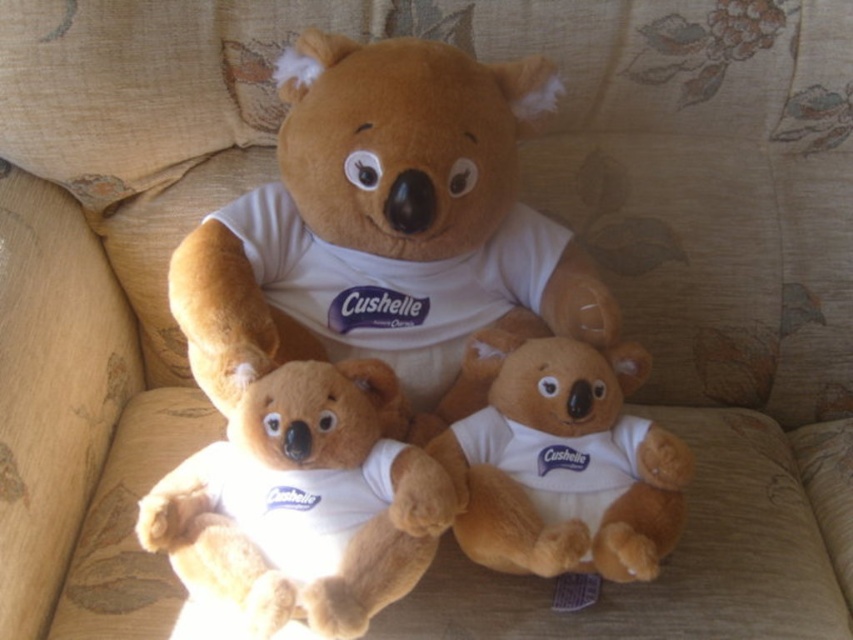
Based on the photo, you are looking at the image of three koala bears on the sofa. There is a point at coordinates (386, 227). Which object is located at that point?

The point at coordinates (386, 227) indicates the white soft t shirt at center.

You are a photographer trying to capture the soft plush bear at center and the soft plush teddy bear at center in a single shot. Which one should you focus on first if you want to ensure both are in focus?

The soft plush bear at center is located below the soft plush teddy bear at center, so you should focus on the soft plush teddy bear at center first because it is closer to the camera.